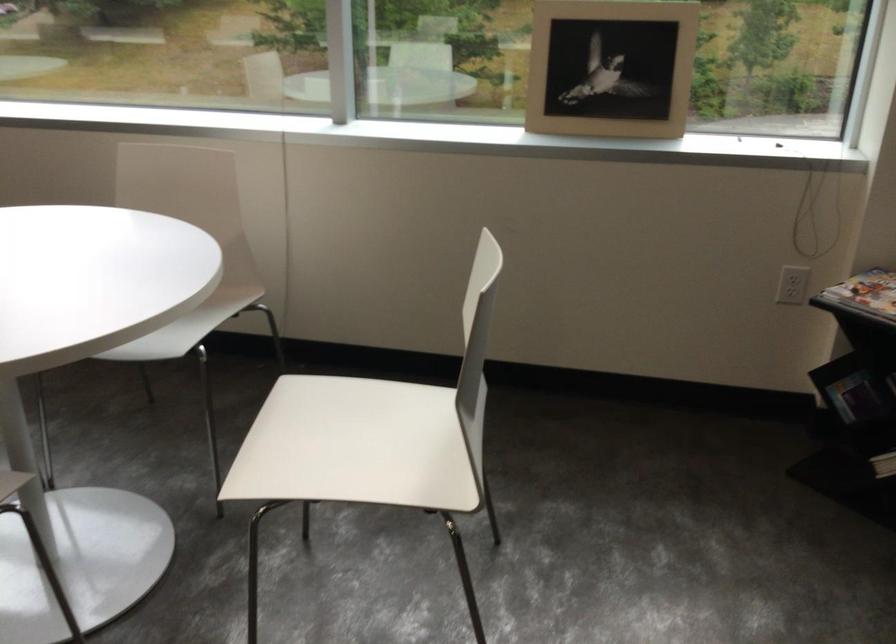
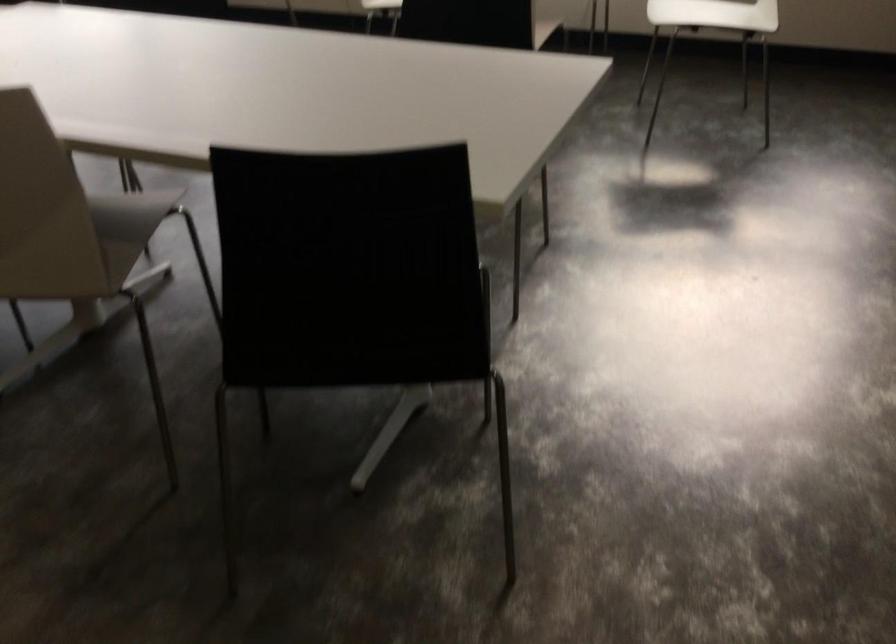
Which direction would the cameraman need to move to produce the second image?

The movement direction of the cameraman is left, backward.